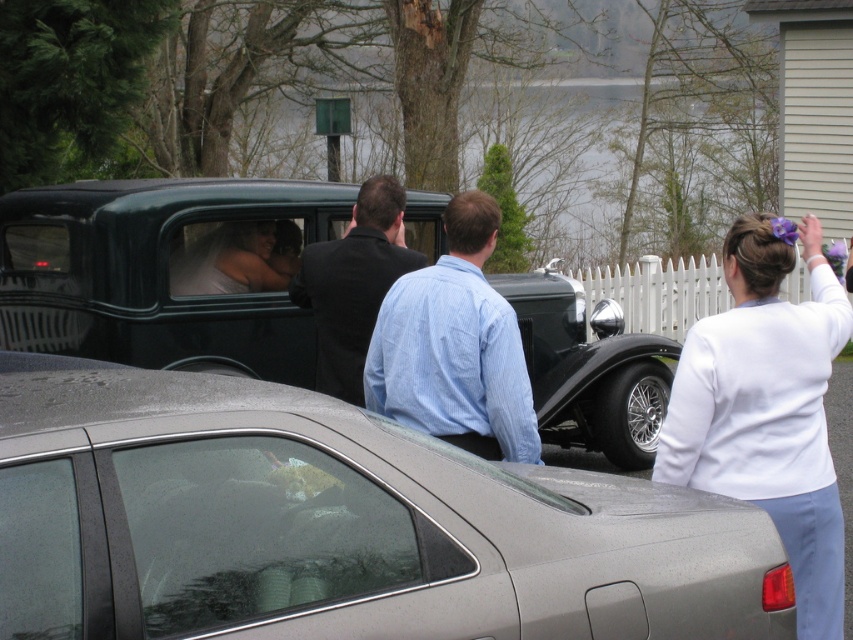
Is shiny black car at center bigger than dark suit at center?

Correct, shiny black car at center is larger in size than dark suit at center.

Who is shorter, shiny black car at center or dark suit at center?

dark suit at center is shorter.

Locate an element on the screen. This screenshot has height=640, width=853. shiny black car at center is located at coordinates (166, 272).

Locate an element on the screen. satin silver car at center is located at coordinates 340,525.

Does satin silver car at center have a greater height compared to shiny black car at center?

No, satin silver car at center is not taller than shiny black car at center.

Between point (279, 458) and point (57, 250), which one is positioned in front?

Point (279, 458) is more forward.

You are a GUI agent. You are given a task and a screenshot of the screen. Output one action in this format:
    pyautogui.click(x=<x>, y=<y>)
    Task: Click on the satin silver car at center
    
    Given the screenshot: What is the action you would take?
    pyautogui.click(x=340, y=525)

Who is more distant from viewer, (106, 493) or (462, 241)?

The point (462, 241) is more distant.

Who is taller, satin silver car at center or blue striped shirt at center?

With more height is blue striped shirt at center.

The height and width of the screenshot is (640, 853). Describe the element at coordinates (340, 525) in the screenshot. I see `satin silver car at center` at that location.

You are a GUI agent. You are given a task and a screenshot of the screen. Output one action in this format:
    pyautogui.click(x=<x>, y=<y>)
    Task: Click on the satin silver car at center
    Image resolution: width=853 pixels, height=640 pixels.
    Given the screenshot: What is the action you would take?
    pyautogui.click(x=340, y=525)